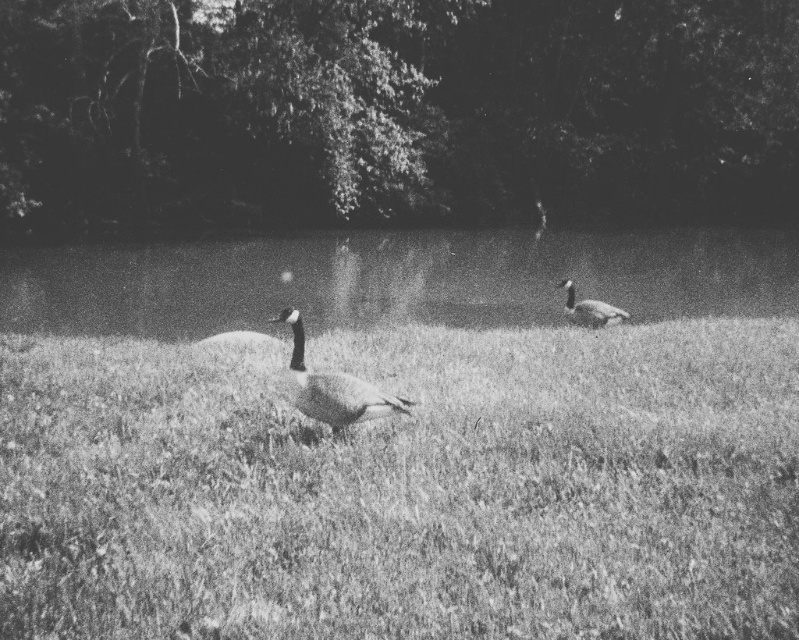
Between smooth water at center and gray feathered duck at center, which one has more height?

smooth water at center is taller.

Who is more distant from viewer, [741,257] or [352,422]?

Point [741,257]

Find the location of a particular element. smooth water at center is located at coordinates (394, 280).

Which is below, grassy field at center or dark gray feathered duck at center?

grassy field at center

You are a GUI agent. You are given a task and a screenshot of the screen. Output one action in this format:
    pyautogui.click(x=<x>, y=<y>)
    Task: Click on the grassy field at center
    Image resolution: width=799 pixels, height=640 pixels.
    Given the screenshot: What is the action you would take?
    pyautogui.click(x=407, y=488)

Who is more forward, [22,515] or [590,321]?

Point [22,515] is more forward.

You are a GUI agent. You are given a task and a screenshot of the screen. Output one action in this format:
    pyautogui.click(x=<x>, y=<y>)
    Task: Click on the grassy field at center
    This screenshot has height=640, width=799.
    Given the screenshot: What is the action you would take?
    pyautogui.click(x=407, y=488)

Does smooth water at center appear on the right side of dark gray feathered duck at center?

Yes, smooth water at center is to the right of dark gray feathered duck at center.

Where is `smooth water at center`? Image resolution: width=799 pixels, height=640 pixels. smooth water at center is located at coordinates (394, 280).

This screenshot has width=799, height=640. In order to click on smooth water at center in this screenshot , I will do `click(394, 280)`.